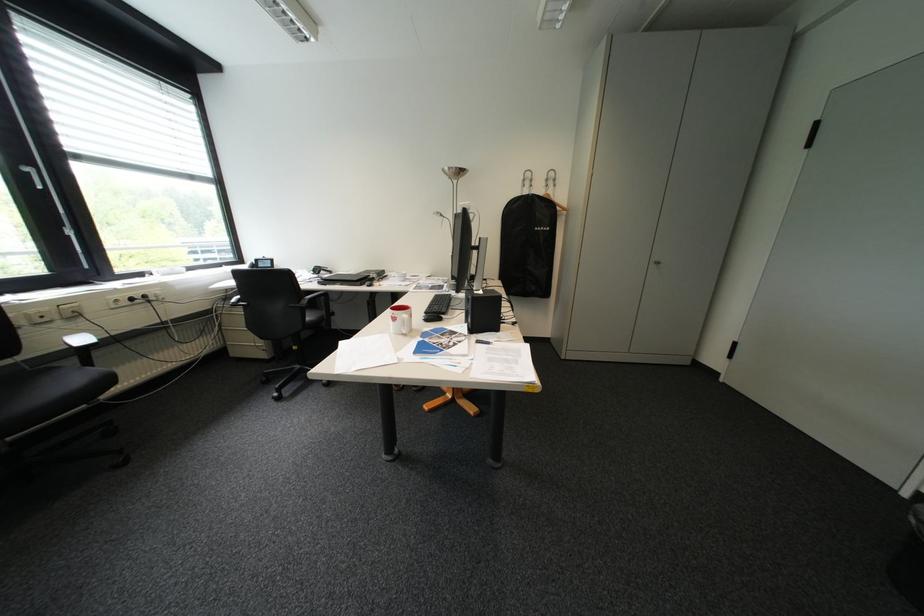
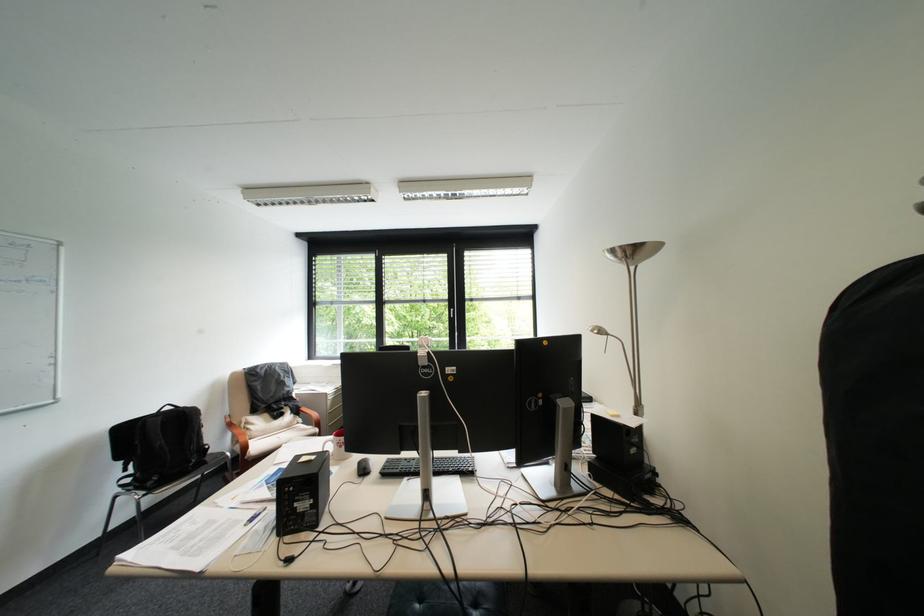
Where in the second image is the point corresponding to point 462,169 from the first image?

(625, 252)